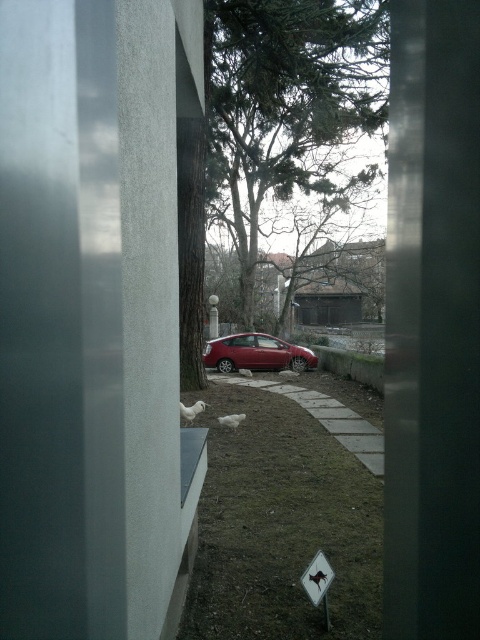
Is point (332, 449) positioned behind point (301, 365)?

No, it is not.

Is green grass at lower center taller than shiny red car at center?

No, green grass at lower center is not taller than shiny red car at center.

Which is in front, point (380, 477) or point (283, 344)?

Point (380, 477) is more forward.

The width and height of the screenshot is (480, 640). What are the coordinates of `green grass at lower center` in the screenshot? It's located at (280, 524).

Who is more distant from viewer, (x=237, y=33) or (x=302, y=362)?

The point (x=302, y=362) is behind.

Does green leafy tree at center have a smaller size compared to shiny red car at center?

Actually, green leafy tree at center might be larger than shiny red car at center.

The width and height of the screenshot is (480, 640). What are the coordinates of `green leafy tree at center` in the screenshot? It's located at (288, 106).

Is green grass at lower center wider than metallic diamond-shaped sign at lower center?

Indeed, green grass at lower center has a greater width compared to metallic diamond-shaped sign at lower center.

Which is above, green grass at lower center or metallic diamond-shaped sign at lower center?

metallic diamond-shaped sign at lower center is higher up.

Between point (371, 536) and point (317, 561), which one is positioned behind?

The point (371, 536) is behind.

Locate an element on the screen. Image resolution: width=480 pixels, height=640 pixels. green grass at lower center is located at coordinates [280, 524].